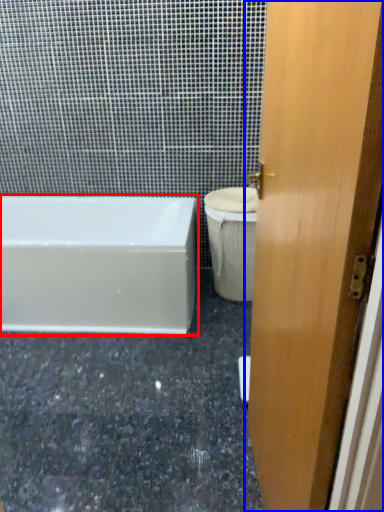
Question: Among these objects, which one is nearest to the camera, bathtub (highlighted by a red box) or door (highlighted by a blue box)?

Choices:
 (A) bathtub
 (B) door

Answer: (B)